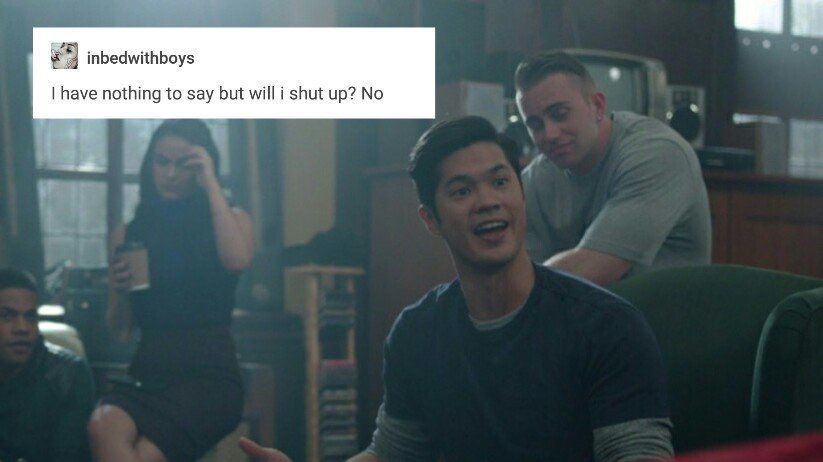
Find the location of a particular element. old square tv is located at coordinates click(x=621, y=71).